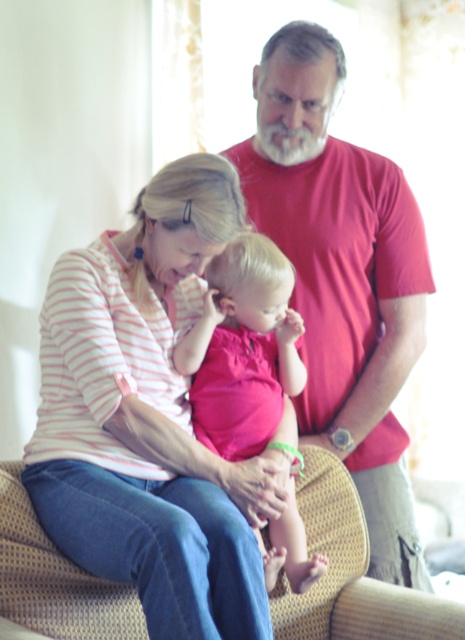
You are an interior designer observing the scene. You need to determine the vertical arrangement of the pink striped shirt at center and the smooth red shirt at center. Which one is positioned lower?

The pink striped shirt at center is located below the smooth red shirt at center, so the pink striped shirt at center is positioned lower.

In the scene described, there is a point located at coordinates (343,278). Based on the objects present, what object is this point most likely part of?

The point at (343,278) is on the smooth red shirt at center.

You are trying to locate the smooth red shirt at center in the image. According to the coordinates provided, where exactly is it positioned?

The smooth red shirt at center is located at point coordinates (343,278).